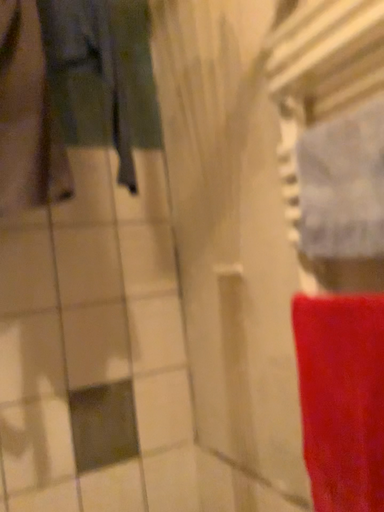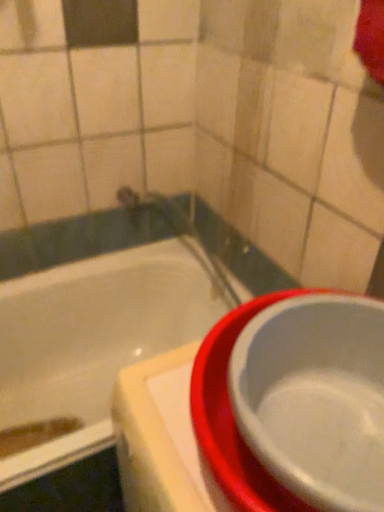
Question: How did the camera likely rotate when shooting the video?

Choices:
 (A) rotated downward
 (B) rotated upward

Answer: (A)